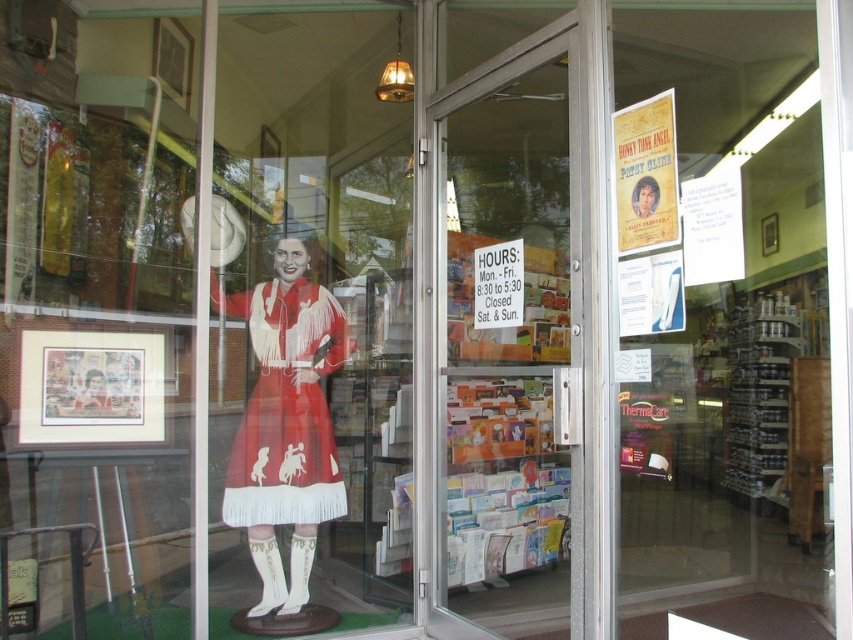
Question: Can you confirm if matte paper poster at upper right is positioned below white paper sign at center?

Choices:
 (A) yes
 (B) no

Answer: (B)

Question: Which object is farther from the camera taking this photo?

Choices:
 (A) transparent glass door at center
 (B) matte paper poster at upper right

Answer: (A)

Question: Can you confirm if white fringed dress at center is positioned above matte paper poster at upper right?

Choices:
 (A) yes
 (B) no

Answer: (B)

Question: Which object appears farthest from the camera in this image?

Choices:
 (A) transparent glass door at center
 (B) matte paper poster at upper right
 (C) white paper sign at center

Answer: (C)

Question: Which point is farther to the camera?

Choices:
 (A) (669, 200)
 (B) (289, 374)
 (C) (509, 305)
 (D) (563, 513)

Answer: (D)

Question: Where is transparent glass door at center located in relation to matte paper poster at upper right in the image?

Choices:
 (A) below
 (B) above

Answer: (A)